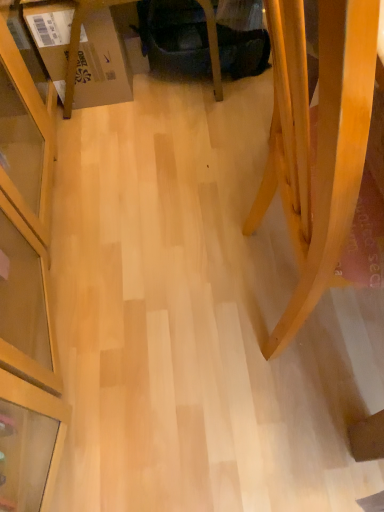
Question: From the image's perspective, is cardboard box at left under velvet dark blue swivel chair at center?

Choices:
 (A) yes
 (B) no

Answer: (A)

Question: Is cardboard box at left wider than velvet dark blue swivel chair at center?

Choices:
 (A) yes
 (B) no

Answer: (B)

Question: Could you tell me if cardboard box at left is turned towards velvet dark blue swivel chair at center?

Choices:
 (A) no
 (B) yes

Answer: (A)

Question: Considering the relative positions of cardboard box at left and velvet dark blue swivel chair at center in the image provided, is cardboard box at left in front of velvet dark blue swivel chair at center?

Choices:
 (A) no
 (B) yes

Answer: (B)

Question: Considering the relative positions of cardboard box at left and velvet dark blue swivel chair at center in the image provided, is cardboard box at left to the left of velvet dark blue swivel chair at center from the viewer's perspective?

Choices:
 (A) no
 (B) yes

Answer: (B)

Question: Is cardboard box at left looking in the opposite direction of velvet dark blue swivel chair at center?

Choices:
 (A) yes
 (B) no

Answer: (B)

Question: Considering the relative positions of light wood chair at lower right and cardboard box at left in the image provided, is light wood chair at lower right in front of cardboard box at left?

Choices:
 (A) yes
 (B) no

Answer: (A)

Question: Considering the relative sizes of light wood chair at lower right and cardboard box at left in the image provided, is light wood chair at lower right shorter than cardboard box at left?

Choices:
 (A) no
 (B) yes

Answer: (A)

Question: Considering the relative sizes of light wood chair at lower right and cardboard box at left in the image provided, is light wood chair at lower right thinner than cardboard box at left?

Choices:
 (A) yes
 (B) no

Answer: (B)

Question: Is light wood chair at lower right looking in the opposite direction of cardboard box at left?

Choices:
 (A) yes
 (B) no

Answer: (B)

Question: Does light wood chair at lower right have a greater height compared to cardboard box at left?

Choices:
 (A) yes
 (B) no

Answer: (A)

Question: Is cardboard box at left located within light wood chair at lower right?

Choices:
 (A) yes
 (B) no

Answer: (B)

Question: From the image's perspective, is velvet dark blue swivel chair at center over cardboard box at left?

Choices:
 (A) yes
 (B) no

Answer: (A)